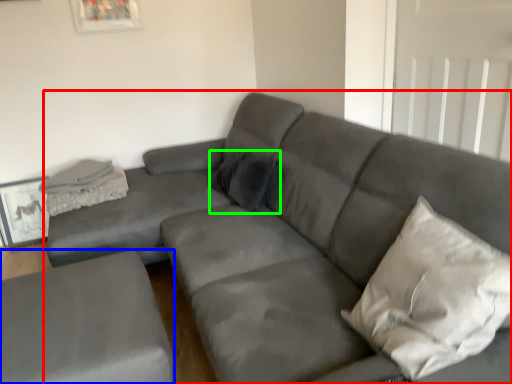
Question: Which object is the farthest from studio couch (highlighted by a red box)? Choose among these: studio couch (highlighted by a blue box) or pillow (highlighted by a green box).

Choices:
 (A) studio couch
 (B) pillow

Answer: (A)